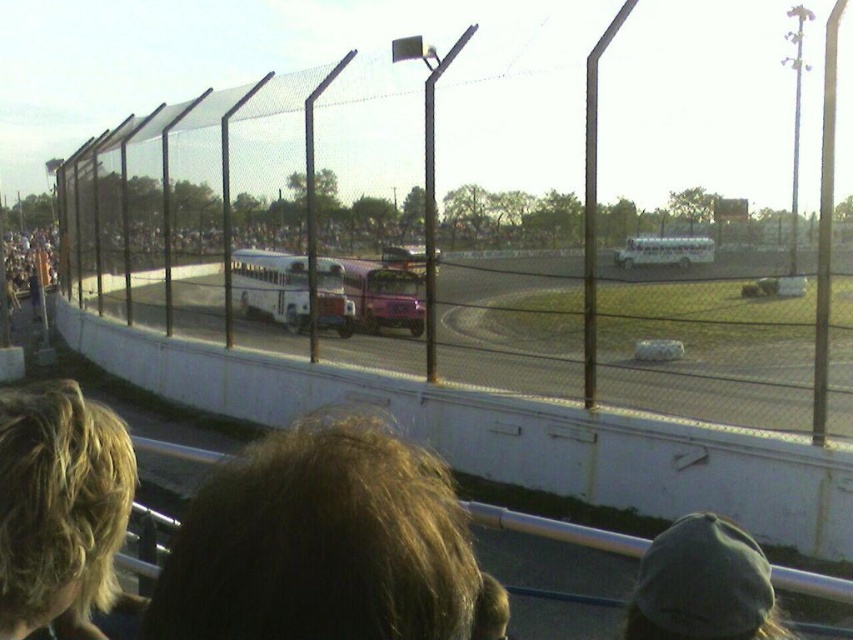
You are a photographer standing at the edge of the race track. You want to take a photo of the blonde hair at upper left and the green fabric cap at lower right. Which object will appear larger in your photo?

The blonde hair at upper left will appear larger in the photo because it is closer to the viewer than the green fabric cap at lower right.

You are a photographer at the race track event. You want to take a photo of the blonde hair at upper left without the brown hair at center blocking the view. Is it possible to adjust your position to achieve this?

The blonde hair at upper left is behind the brown hair at center, so adjusting your position might allow you to capture the blonde hair at upper left without the brown hair at center blocking the view by moving to a position where the brown hair at center is no longer in front.